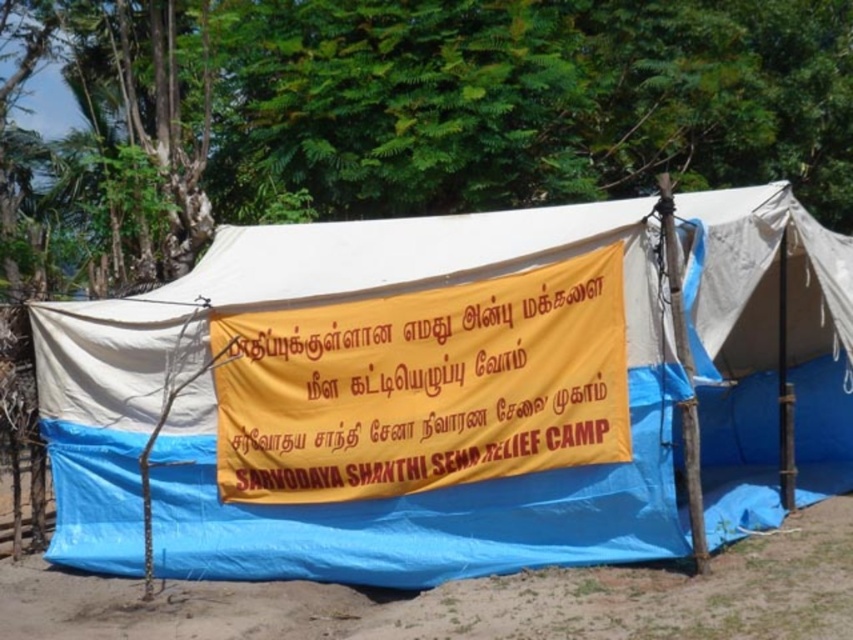
Between green leafy tree at upper center and brown dirt field at lower center, which one appears on the right side from the viewer's perspective?

brown dirt field at lower center

Is point (271, 84) positioned before point (13, 586)?

No, (271, 84) is behind (13, 586).

Does point (599, 97) come closer to viewer compared to point (171, 637)?

No, (599, 97) is behind (171, 637).

At what (x,y) coordinates should I click in order to perform the action: click on green leafy tree at upper center. Please return your answer as a coordinate pair (x, y). Looking at the image, I should click on (397, 116).

Is blue tarpaulin tent at center closer to the viewer compared to yellow fabric banner at center?

No.

What do you see at coordinates (445, 394) in the screenshot? The height and width of the screenshot is (640, 853). I see `blue tarpaulin tent at center` at bounding box center [445, 394].

Is point (369, 406) farther from viewer compared to point (508, 452)?

Yes, it is.

Locate an element on the screen. The width and height of the screenshot is (853, 640). blue tarpaulin tent at center is located at coordinates (445, 394).

Does blue tarpaulin tent at center have a lesser width compared to green leafy tree at upper center?

Yes, blue tarpaulin tent at center is thinner than green leafy tree at upper center.

Between blue tarpaulin tent at center and green leafy tree at upper center, which one appears on the left side from the viewer's perspective?

green leafy tree at upper center is more to the left.

What are the coordinates of `blue tarpaulin tent at center` in the screenshot? It's located at (445, 394).